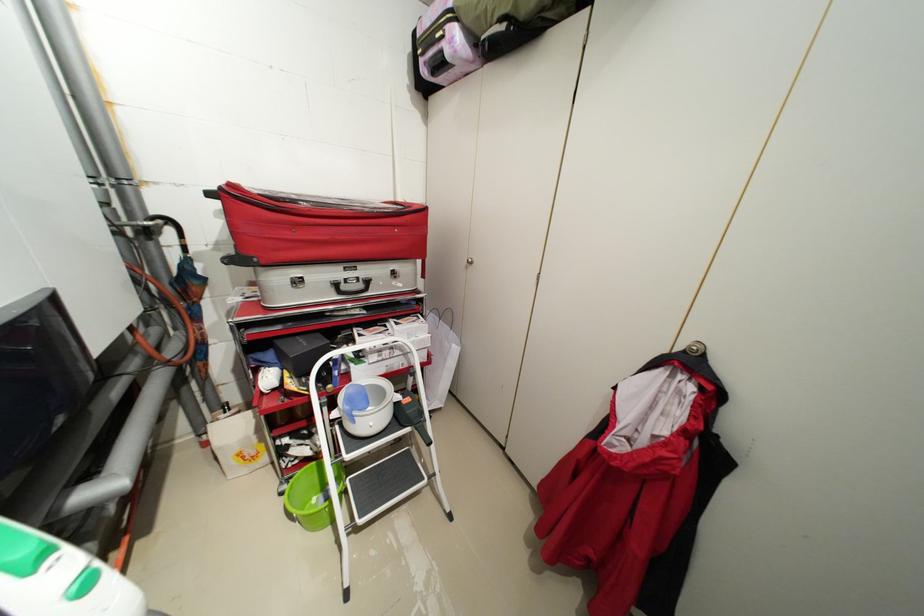
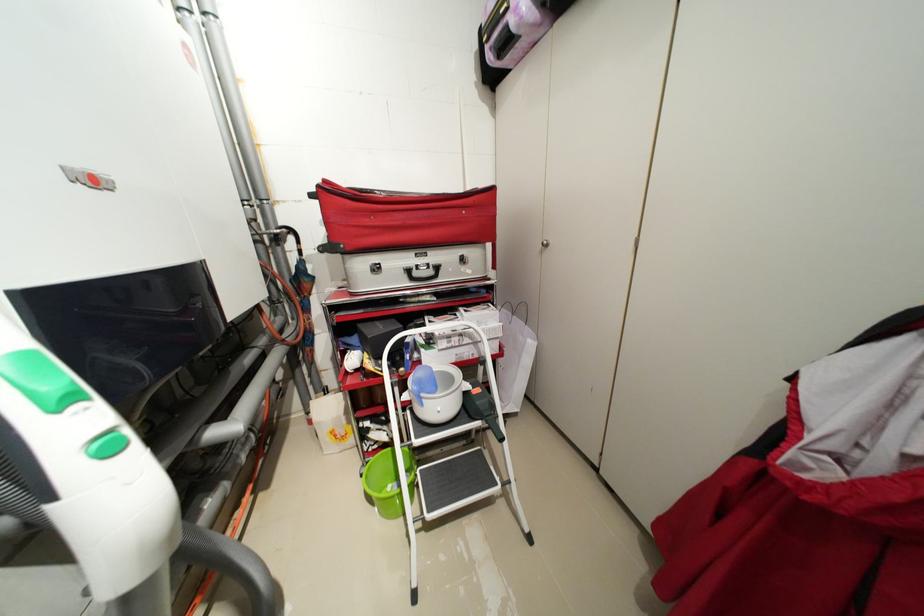
In the second image, find the point that corresponds to the point at 415,400 in the first image.

(484, 391)